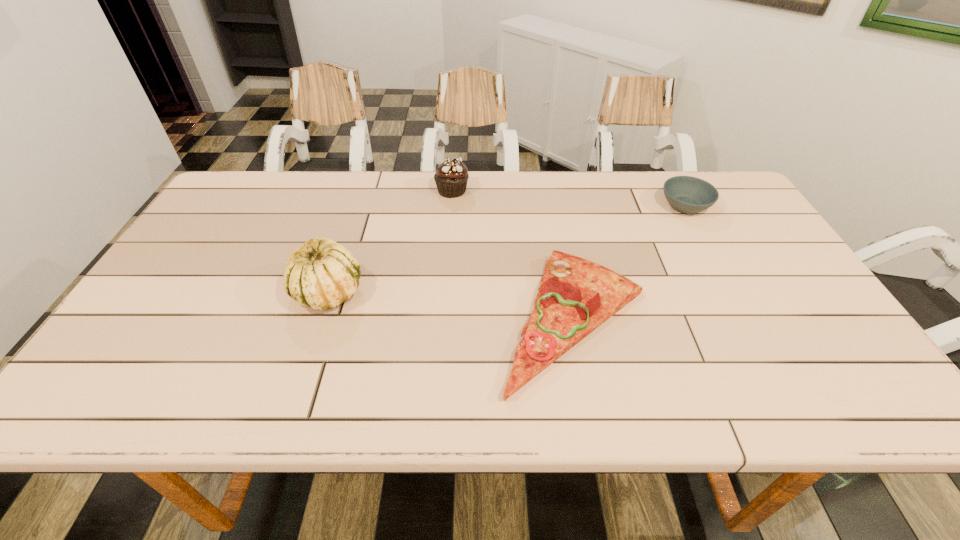
I want to click on cupcake positioned at the far edge, so click(451, 178).

Locate an element on the screen. The image size is (960, 540). soup bowl located at the far edge is located at coordinates (686, 194).

What are the coordinates of `object at the near edge` in the screenshot? It's located at (576, 296).

Identify the location of object that is positioned at the right edge. (686, 194).

I want to click on object at the far right corner, so click(x=686, y=194).

This screenshot has width=960, height=540. Find the location of `vacant space at the far edge of the desktop`. vacant space at the far edge of the desktop is located at coordinates (528, 170).

At what (x,y) coordinates should I click in order to perform the action: click on vacant space at the near edge of the desktop. Please return your answer as a coordinate pair (x, y). The image size is (960, 540). Looking at the image, I should click on (211, 388).

Find the location of a particular element. This screenshot has width=960, height=540. free spot at the left edge of the desktop is located at coordinates coord(230,215).

Where is `vacant space at the right edge of the desktop`? Image resolution: width=960 pixels, height=540 pixels. vacant space at the right edge of the desktop is located at coordinates (756, 239).

Image resolution: width=960 pixels, height=540 pixels. In the image, there is a desktop. What are the coordinates of `free space at the far left corner` in the screenshot? It's located at (259, 172).